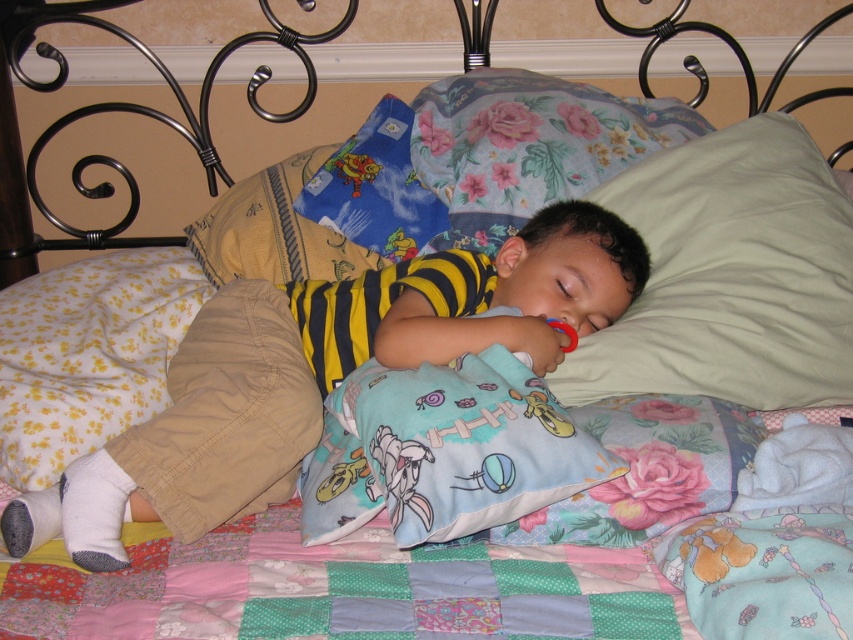
Question: Which object is the farthest from the light blue flannel pillow at center?

Choices:
 (A) black wrought iron headboard at upper center
 (B) beige soft pillow at upper right

Answer: (A)

Question: Where is patchwork quilt at center located in relation to floral fabric pillow at upper center in the image?

Choices:
 (A) below
 (B) above

Answer: (A)

Question: Can you confirm if beige soft pillow at upper right is smaller than floral fabric pillow at upper center?

Choices:
 (A) yes
 (B) no

Answer: (B)

Question: Among these points, which one is farthest from the camera?

Choices:
 (A) (656, 172)
 (B) (468, 124)
 (C) (358, 419)

Answer: (B)

Question: Is yellow striped shirt at center to the right of black wrought iron headboard at upper center from the viewer's perspective?

Choices:
 (A) yes
 (B) no

Answer: (B)

Question: Which object is farther from the camera taking this photo?

Choices:
 (A) floral fabric pillow at upper center
 (B) black wrought iron headboard at upper center

Answer: (B)